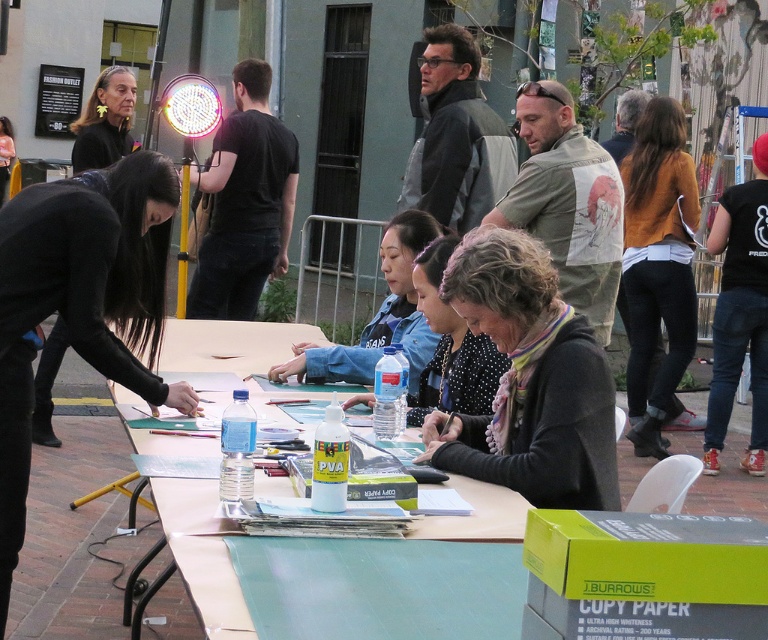
Question: Estimate the real-world distances between objects in this image. Which object is farther from the black matte hair at left?

Choices:
 (A) light brown wooden table at center
 (B) multicolored scarf at center

Answer: (B)

Question: Can you confirm if multicolored scarf at center is smaller than polka dot blouse at center?

Choices:
 (A) no
 (B) yes

Answer: (A)

Question: Is denim jacket at center positioned before matte black hair at upper left?

Choices:
 (A) yes
 (B) no

Answer: (A)

Question: Considering the real-world distances, which object is farthest from the matte black hair at upper left?

Choices:
 (A) polka dot blouse at center
 (B) brown sweater at right
 (C) black matte hair at left

Answer: (B)

Question: Is multicolored scarf at center below brown sweater at right?

Choices:
 (A) yes
 (B) no

Answer: (A)

Question: Among these points, which one is farthest from the camera?

Choices:
 (A) (646, 276)
 (B) (480, 500)
 (C) (419, 244)

Answer: (A)